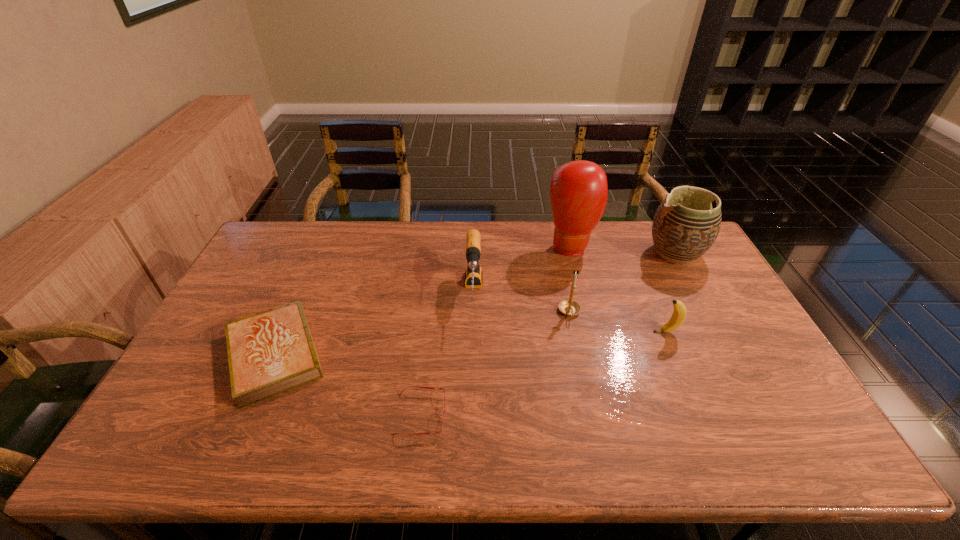
I want to click on spectacles, so click(x=410, y=386).

Where is `vacant area located 0.310m on the striking surface of the boxing glove`? vacant area located 0.310m on the striking surface of the boxing glove is located at coordinates pyautogui.click(x=592, y=330).

Locate an element on the screen. The image size is (960, 540). vacant space situated 0.200m on the left of the pottery is located at coordinates (589, 253).

Find the location of `free point located on the handle side of the third object from left to right`. free point located on the handle side of the third object from left to right is located at coordinates (471, 407).

At what (x,y) coordinates should I click in order to perform the action: click on vacant space located on the handle side of the candle holder. Please return your answer as a coordinate pair (x, y). The image size is (960, 540). Looking at the image, I should click on (579, 355).

Find the location of a particular element. vacant space located from the stem of the fifth tallest object is located at coordinates (615, 332).

The image size is (960, 540). In order to click on vacant space located 0.260m from the stem of the fifth tallest object in this screenshot , I will do `click(564, 332)`.

The image size is (960, 540). Find the location of `vacant region located from the stem of the fifth tallest object`. vacant region located from the stem of the fifth tallest object is located at coordinates (553, 332).

The image size is (960, 540). I want to click on free space located 0.300m on the right of the second shortest object, so click(441, 354).

Locate an element on the screen. free space located 0.100m on the lenses of the second object from left to right is located at coordinates (487, 414).